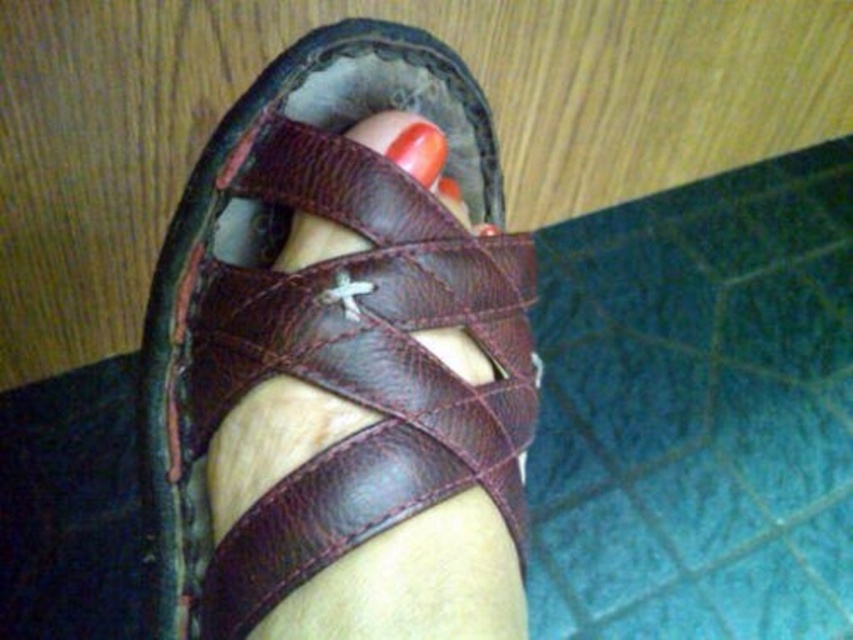
You are a shoe designer examining a sandal and a nail polish detail in the image. Which object is taller between the brown leather sandal at center and the glossy orange nail at center?

The brown leather sandal at center is much taller as glossy orange nail at center.

You are standing in a room with a wooden floor and blue tiles. You see a brown leather sandal at center. Where is the brown leather sandal located in relation to the blue tiles?

The brown leather sandal at center is located near the blue tiles since part of the blue tiled surface is visible in the background.

You are a photographer taking a close up shot of the brown leather sandal at center and the glossy orange nail at center. Which object should you focus on first to ensure both are in sharp focus?

The brown leather sandal at center is closer to the viewer than the glossy orange nail at center, so you should focus on the brown leather sandal at center first to ensure both are in sharp focus.